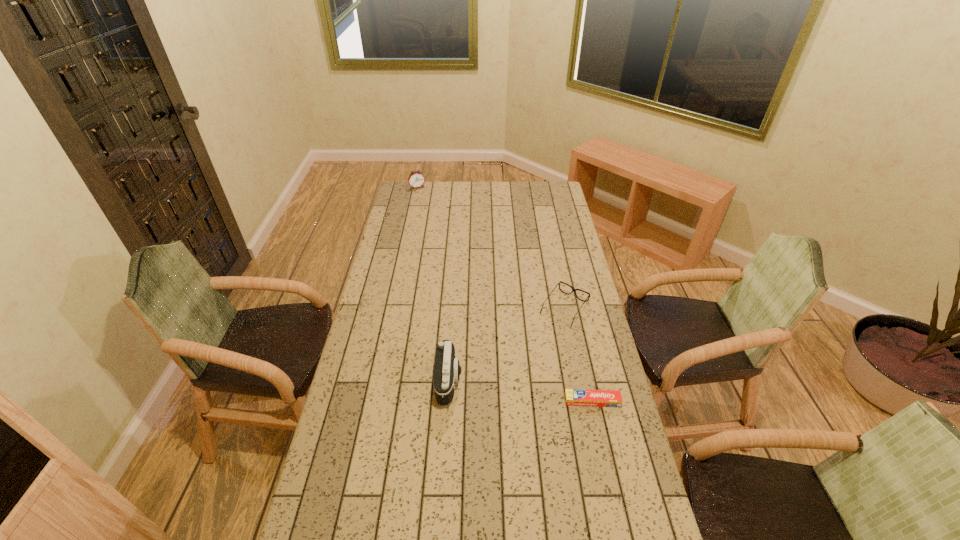
The height and width of the screenshot is (540, 960). Find the location of `free space on the desktop that is between the camera and the shortest object and is positioned on the clock face of the alarm clock`. free space on the desktop that is between the camera and the shortest object and is positioned on the clock face of the alarm clock is located at coordinates (520, 391).

Locate an element on the screen. free spot on the desktop that is between the camera and the toothpaste and is positioned with the lenses facing outward on the third nearest object is located at coordinates point(503,389).